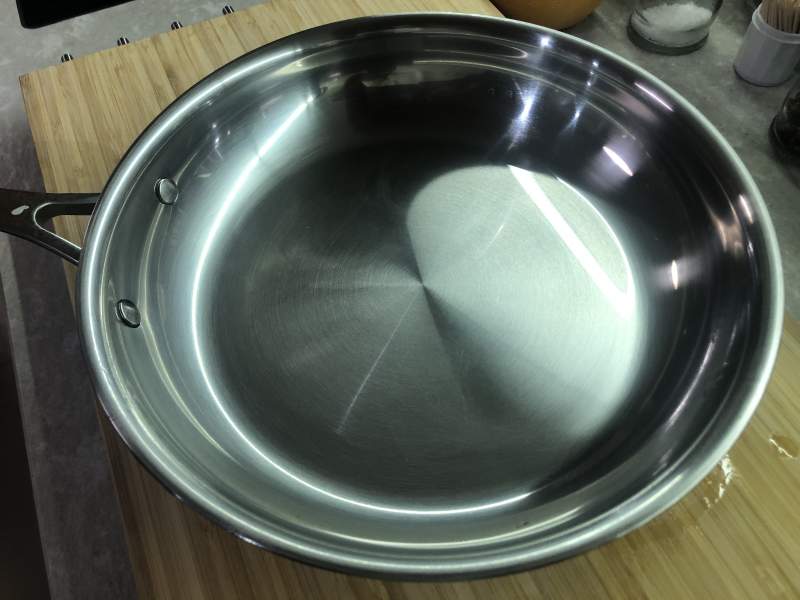
In order to click on counter in this screenshot , I will do `click(20, 37)`.